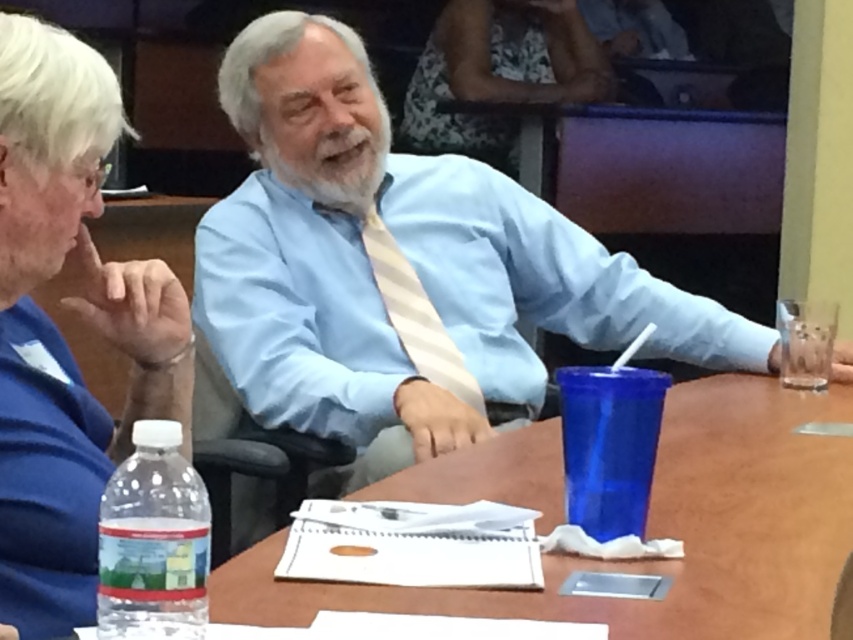
In the scene shown: Can you confirm if wooden table at center is positioned to the left of blue fabric shirt at upper left?

In fact, wooden table at center is to the right of blue fabric shirt at upper left.

Can you confirm if wooden table at center is taller than blue fabric shirt at upper left?

In fact, wooden table at center may be shorter than blue fabric shirt at upper left.

What do you see at coordinates (657, 532) in the screenshot?
I see `wooden table at center` at bounding box center [657, 532].

This screenshot has height=640, width=853. In order to click on wooden table at center in this screenshot , I will do `click(657, 532)`.

Between blue fabric shirt at upper left and white floral dress at upper center, which one is positioned higher?

Positioned higher is white floral dress at upper center.

Is blue fabric shirt at upper left thinner than white floral dress at upper center?

Yes, blue fabric shirt at upper left is thinner than white floral dress at upper center.

Who is more distant from viewer, (93, 484) or (459, 19)?

Positioned behind is point (459, 19).

The width and height of the screenshot is (853, 640). In order to click on blue fabric shirt at upper left in this screenshot , I will do `click(57, 332)`.

Can you confirm if wooden table at center is bigger than white floral dress at upper center?

Correct, wooden table at center is larger in size than white floral dress at upper center.

In the scene shown: Can you confirm if wooden table at center is positioned to the right of white floral dress at upper center?

Indeed, wooden table at center is positioned on the right side of white floral dress at upper center.

Describe the element at coordinates (657, 532) in the screenshot. This screenshot has width=853, height=640. I see `wooden table at center` at that location.

Identify the location of wooden table at center. (657, 532).